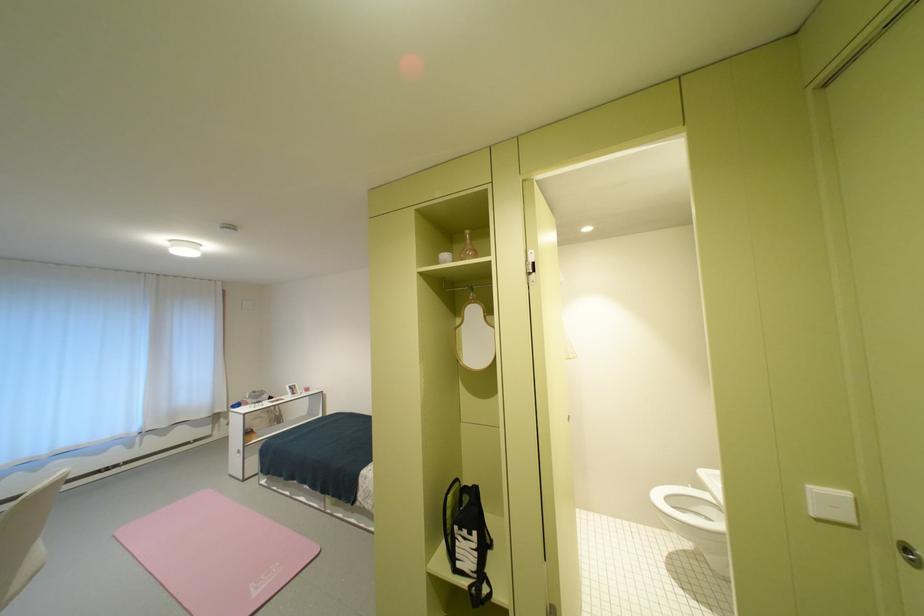
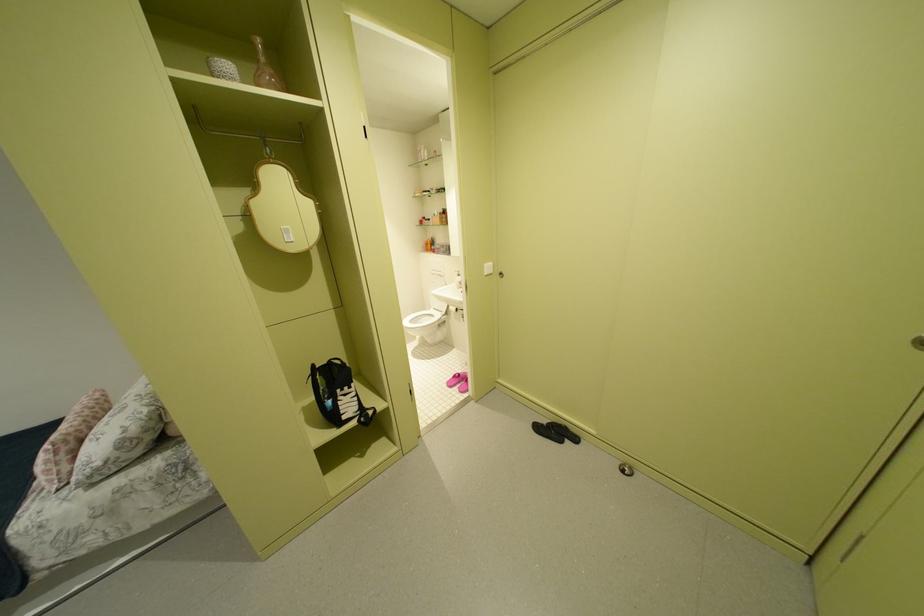
How did the camera likely rotate?

The camera's rotation is toward right-down.